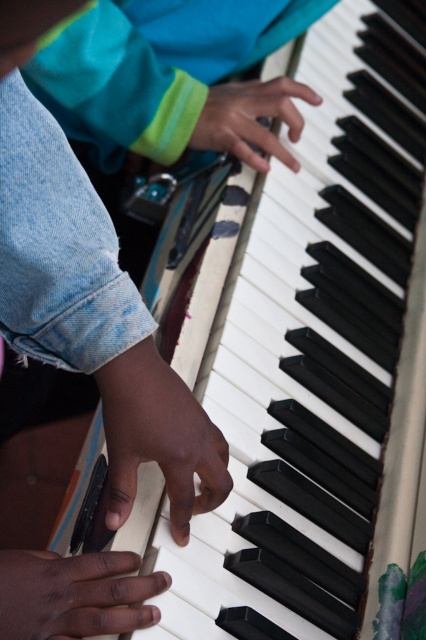
Is smooth skin hand at center to the right of dark skin hand at lower left from the viewer's perspective?

Correct, you'll find smooth skin hand at center to the right of dark skin hand at lower left.

The image size is (426, 640). What do you see at coordinates (158, 438) in the screenshot?
I see `smooth skin hand at center` at bounding box center [158, 438].

What do you see at coordinates (158, 438) in the screenshot? This screenshot has height=640, width=426. I see `smooth skin hand at center` at bounding box center [158, 438].

The height and width of the screenshot is (640, 426). Find the location of `smooth skin hand at center`. smooth skin hand at center is located at coordinates (158, 438).

Can you confirm if smooth skin hand at center is positioned to the right of matte black hand at center?

No, smooth skin hand at center is not to the right of matte black hand at center.

Which is more to the left, smooth skin hand at center or matte black hand at center?

smooth skin hand at center

Is point (106, 426) less distant than point (267, 115)?

That is True.

Locate an element on the screen. The image size is (426, 640). smooth skin hand at center is located at coordinates (158, 438).

Is dark skin hand at lower left bigger than matte black hand at center?

Actually, dark skin hand at lower left might be smaller than matte black hand at center.

Which is more to the right, dark skin hand at lower left or matte black hand at center?

Positioned to the right is matte black hand at center.

Is point (88, 577) positioned before point (229, 106)?

Yes, point (88, 577) is in front of point (229, 106).

The height and width of the screenshot is (640, 426). What are the coordinates of `dark skin hand at lower left` in the screenshot? It's located at (74, 595).